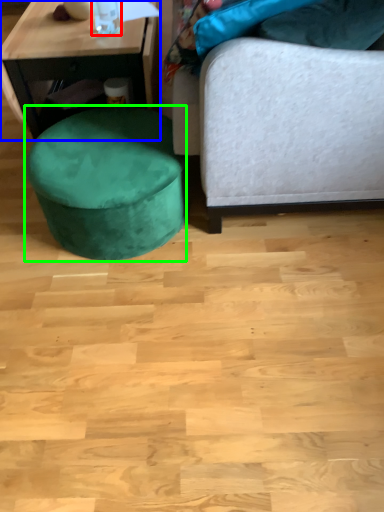
Question: Which object is the closest to the bottle (highlighted by a red box)? Choose among these: table (highlighted by a blue box) or music stool (highlighted by a green box).

Choices:
 (A) table
 (B) music stool

Answer: (A)